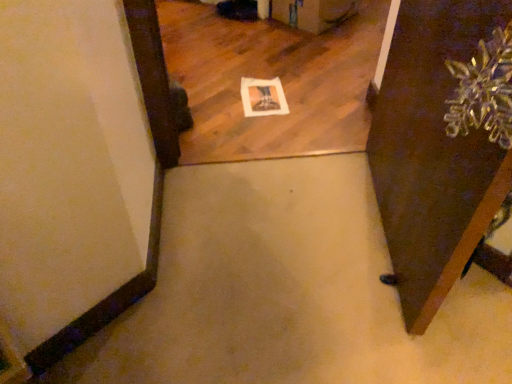
What do you see at coordinates (431, 150) in the screenshot? I see `brown wooden door at lower right` at bounding box center [431, 150].

What is the approximate width of brown wooden door at lower right?

The width of brown wooden door at lower right is 6.76 inches.

Identify the location of brown wooden door at lower right. (431, 150).

You are a GUI agent. You are given a task and a screenshot of the screen. Output one action in this format:
    pyautogui.click(x=<x>, y=<y>)
    Task: Click on the brown wooden door at lower right
    This screenshot has height=384, width=512.
    Given the screenshot: What is the action you would take?
    pyautogui.click(x=431, y=150)